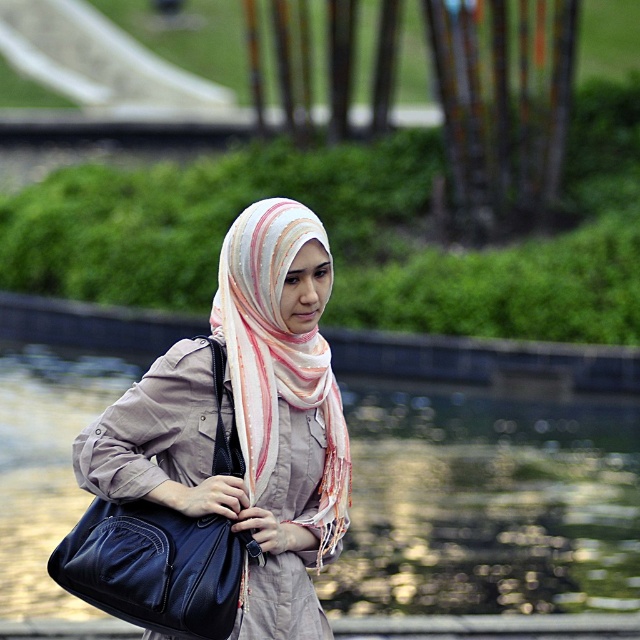
Does glossy water at center have a greater height compared to matte beige scarf at center?

No, glossy water at center is not taller than matte beige scarf at center.

Identify the location of glossy water at center. Image resolution: width=640 pixels, height=640 pixels. (486, 504).

Locate an element on the screen. This screenshot has width=640, height=640. glossy water at center is located at coordinates (486, 504).

What do you see at coordinates (486, 504) in the screenshot?
I see `glossy water at center` at bounding box center [486, 504].

Is glossy water at center above striped silk scarf at center?

Incorrect, glossy water at center is not positioned above striped silk scarf at center.

Is point (500, 557) closer to viewer compared to point (276, 403)?

That is False.

Locate an element on the screen. This screenshot has width=640, height=640. glossy water at center is located at coordinates (486, 504).

Between glossy water at center and matte blue leather bag at center, which one has less height?

matte blue leather bag at center

Is point (12, 486) farther from camera compared to point (164, 604)?

Yes, it is behind point (164, 604).

Does point (508, 595) lie behind point (182, 536)?

Yes.

Find the location of `glossy water at center`. glossy water at center is located at coordinates (486, 504).